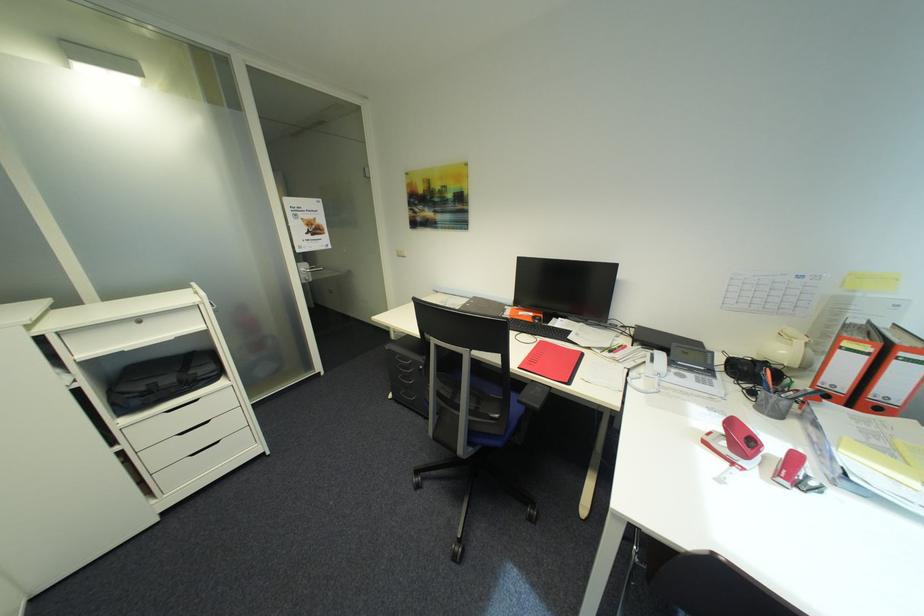
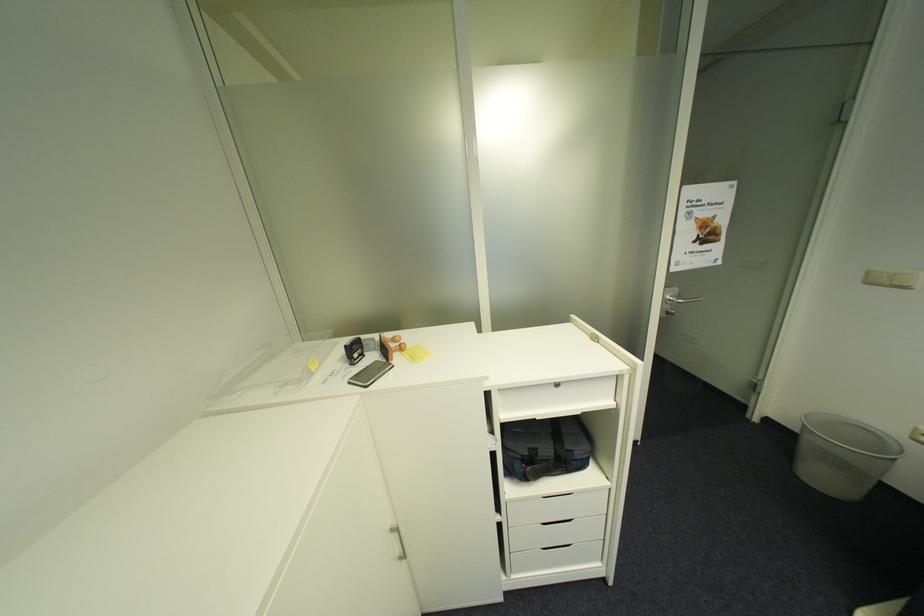
In the second image, find the point that corresponds to point (152, 389) in the first image.

(535, 454)